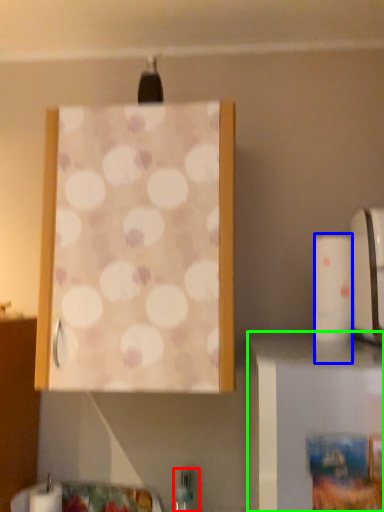
Question: Which object is positioned farthest from bottle (highlighted by a red box)? Select from toilet paper (highlighted by a blue box) and furniture (highlighted by a green box).

Choices:
 (A) toilet paper
 (B) furniture

Answer: (B)